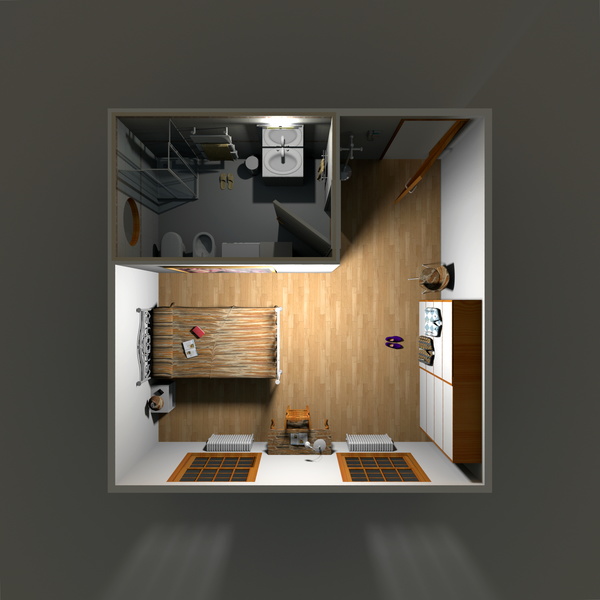
Where is `bed`? The image size is (600, 600). bed is located at coordinates (218, 355), (117, 326), (194, 342), (240, 335).